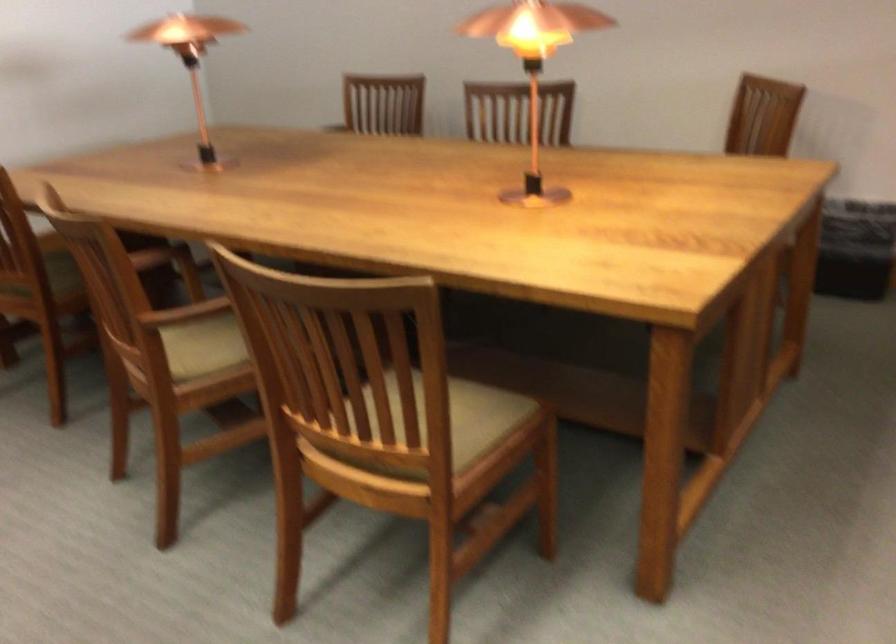
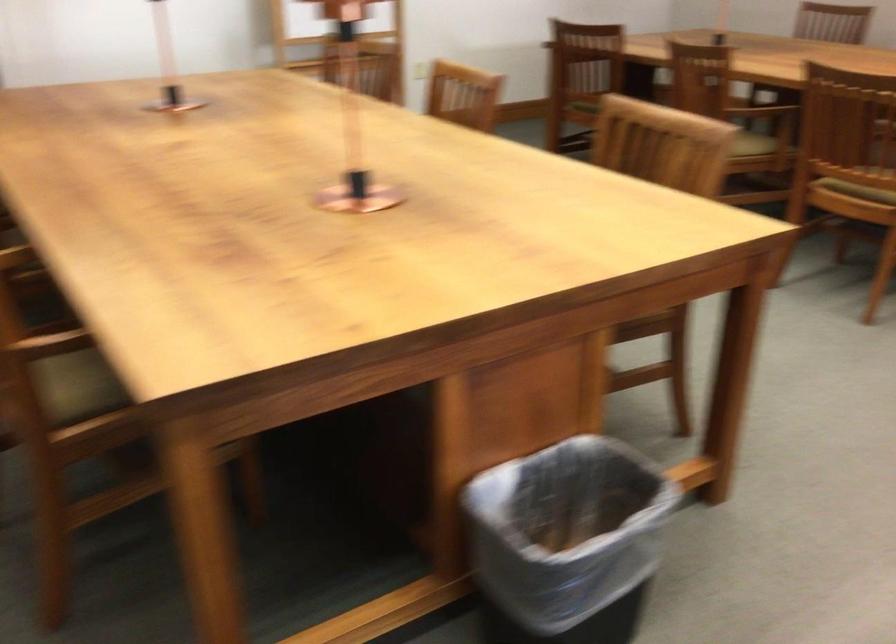
Find the pixel in the second image that matches (211,393) in the first image.

(753, 144)